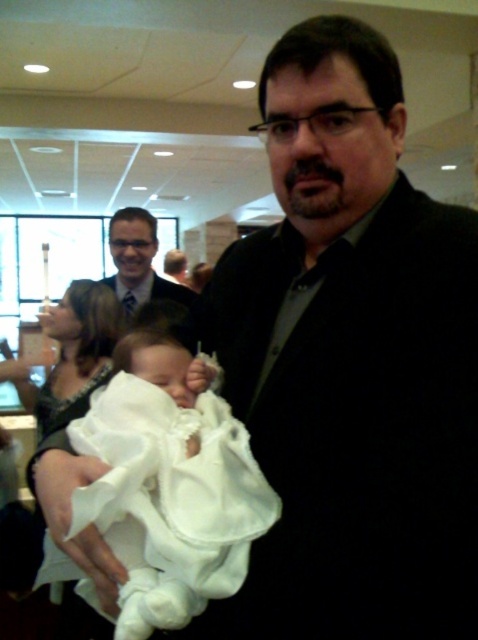
Question: Is white satin baby at center to the right of matte black suit at center from the viewer's perspective?

Choices:
 (A) yes
 (B) no

Answer: (A)

Question: Is white satin baby at center closer to the viewer compared to matte black suit at center?

Choices:
 (A) yes
 (B) no

Answer: (A)

Question: Is white satin baby at center above matte black suit at center?

Choices:
 (A) no
 (B) yes

Answer: (A)

Question: Which point is farther from the camera taking this photo?

Choices:
 (A) (143, 428)
 (B) (150, 282)

Answer: (B)

Question: Among these points, which one is farthest from the camera?

Choices:
 (A) (161, 278)
 (B) (220, 563)

Answer: (A)